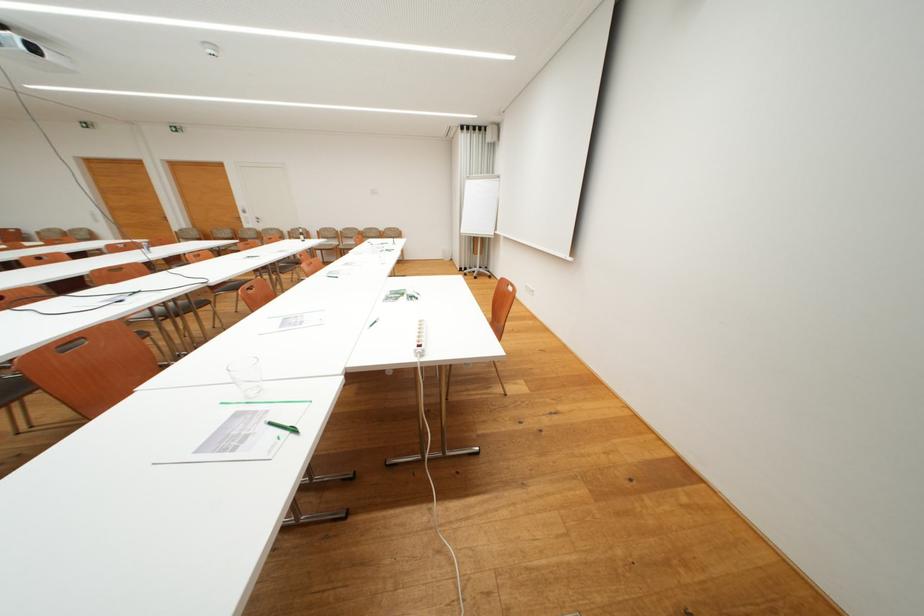
Where would you push the power strip switch? Please return your answer as a coordinate pair (x, y).

(176, 128)